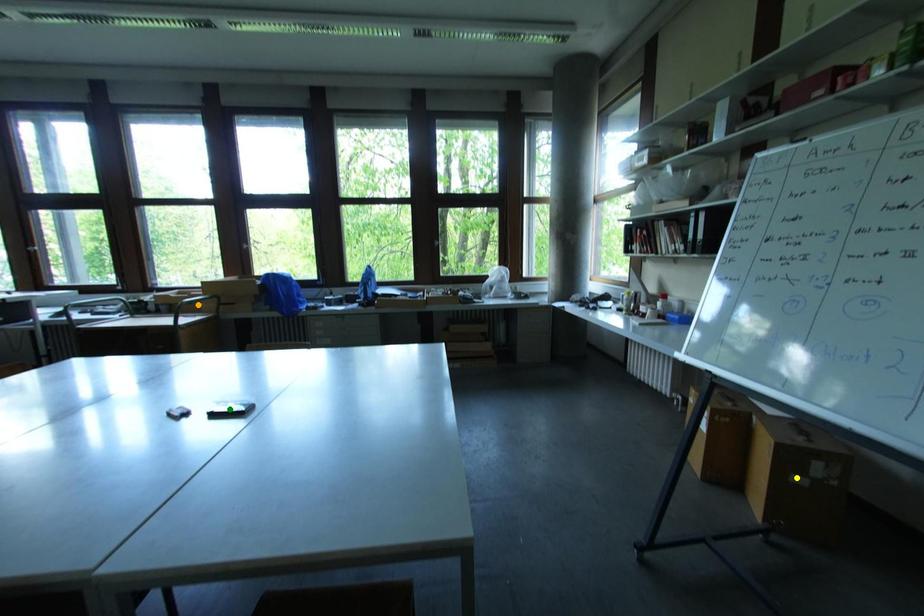
Looking at this image, order these from nearest to farthest:
1. green point
2. yellow point
3. orange point

green point < yellow point < orange point